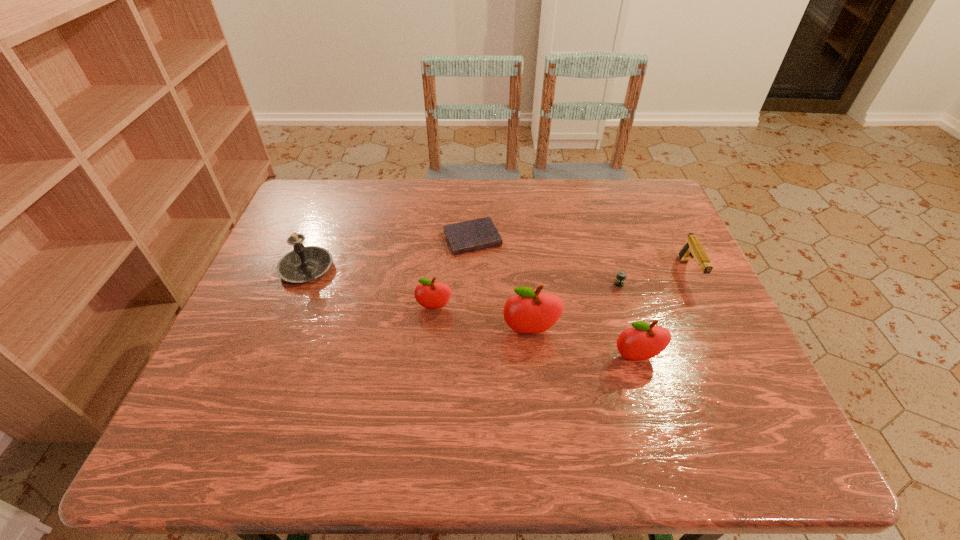
What are the coordinates of `empty space between the shortest object and the leftmost object` in the screenshot? It's located at (390, 254).

Find the location of a particular element. Image resolution: width=960 pixels, height=540 pixels. free spot between the shortest object and the leftmost apple is located at coordinates (453, 273).

At what (x,y) coordinates should I click in order to perform the action: click on empty location between the third nearest object and the rightmost object. Please return your answer as a coordinate pair (x, y). This screenshot has width=960, height=540. Looking at the image, I should click on (562, 290).

This screenshot has width=960, height=540. What are the coordinates of `free spot between the shortest object and the rightmost object` in the screenshot? It's located at (581, 256).

You are a GUI agent. You are given a task and a screenshot of the screen. Output one action in this format:
    pyautogui.click(x=<x>, y=<y>)
    Task: Click on the free point between the sixth tallest object and the candle
    The height and width of the screenshot is (540, 960).
    Given the screenshot: What is the action you would take?
    pyautogui.click(x=463, y=276)

The height and width of the screenshot is (540, 960). I want to click on unoccupied area between the second shortest object and the leftmost object, so click(463, 276).

Locate an element on the screen. This screenshot has height=540, width=960. object that is the fifth closest to the shortest object is located at coordinates (642, 341).

The height and width of the screenshot is (540, 960). I want to click on the fifth closest object to the shortest object, so click(642, 341).

Identify which apple is the second nearest to the diary. Please provide its 2D coordinates. Your answer should be formatted as a tuple, i.e. [(x, y)], where the tuple contains the x and y coordinates of a point satisfying the conditions above.

[(529, 311)]

Locate which apple is the closest to the candle. Please provide its 2D coordinates. Your answer should be formatted as a tuple, i.e. [(x, y)], where the tuple contains the x and y coordinates of a point satisfying the conditions above.

[(428, 294)]